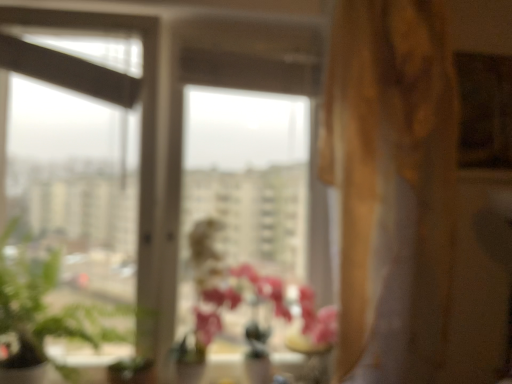
Question: Considering the relative sizes of transparent glass vase at center and pink matte vase at center in the image provided, is transparent glass vase at center thinner than pink matte vase at center?

Choices:
 (A) no
 (B) yes

Answer: (B)

Question: Is transparent glass vase at center outside pink matte vase at center?

Choices:
 (A) yes
 (B) no

Answer: (B)

Question: Does transparent glass vase at center lie behind pink matte vase at center?

Choices:
 (A) no
 (B) yes

Answer: (B)

Question: Considering the relative sizes of transparent glass vase at center and pink matte vase at center in the image provided, is transparent glass vase at center taller than pink matte vase at center?

Choices:
 (A) yes
 (B) no

Answer: (B)

Question: Is transparent glass vase at center at the right side of pink matte vase at center?

Choices:
 (A) no
 (B) yes

Answer: (B)

Question: Considering the positions of gold textured curtain at right and green leafy plant at left in the image, is gold textured curtain at right bigger or smaller than green leafy plant at left?

Choices:
 (A) small
 (B) big

Answer: (B)

Question: Is gold textured curtain at right wider or thinner than green leafy plant at left?

Choices:
 (A) wide
 (B) thin

Answer: (B)

Question: From a real-world perspective, is gold textured curtain at right physically located above or below green leafy plant at left?

Choices:
 (A) above
 (B) below

Answer: (A)

Question: Is gold textured curtain at right inside or outside of green leafy plant at left?

Choices:
 (A) inside
 (B) outside

Answer: (B)

Question: Would you say transparent glass vase at center is to the left or to the right of gold textured curtain at right in the picture?

Choices:
 (A) right
 (B) left

Answer: (B)

Question: From a real-world perspective, is transparent glass vase at center above or below gold textured curtain at right?

Choices:
 (A) below
 (B) above

Answer: (A)

Question: Is point (297, 339) positioned closer to the camera than point (457, 188)?

Choices:
 (A) farther
 (B) closer

Answer: (A)

Question: Is transparent glass vase at center wider or thinner than gold textured curtain at right?

Choices:
 (A) wide
 (B) thin

Answer: (B)

Question: From a real-world perspective, is pink matte vase at center positioned above or below transparent glass vase at center?

Choices:
 (A) below
 (B) above

Answer: (B)

Question: Would you say pink matte vase at center is to the left or to the right of transparent glass vase at center in the picture?

Choices:
 (A) right
 (B) left

Answer: (B)